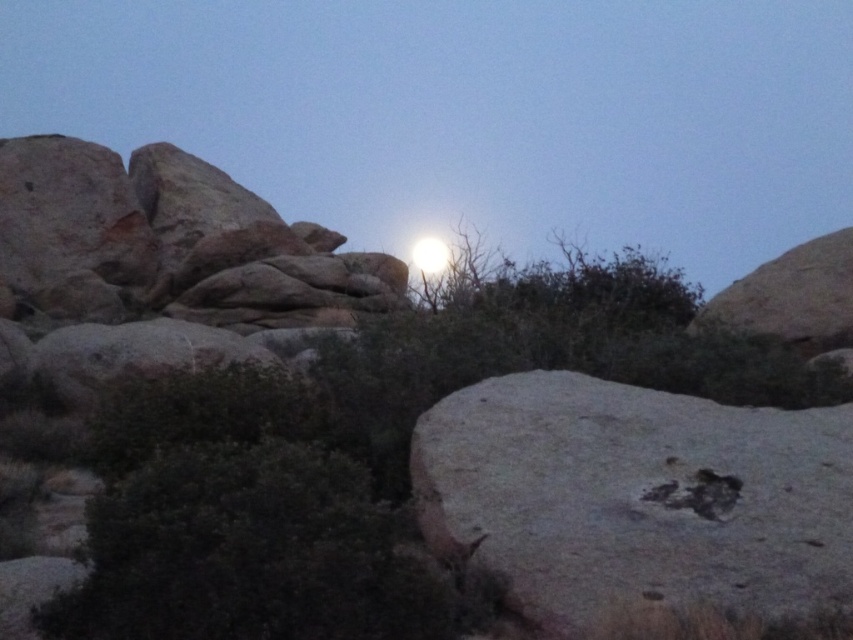
You are a geologist examining the rocks in the twilight scene. You have a measuring tape and need to determine which rock is bigger between the smooth rock at center and the gray rough rock at center. Which one should you measure first based on the scene?

The smooth rock at center is larger in size than the gray rough rock at center, so you should measure the smooth rock at center first.

You are standing at the point with coordinates point (714, 445) and want to walk towards the point with coordinates point (392, 88). Which direction should you face to walk towards the destination?

You should face towards the direction opposite of point (714, 445) to walk towards point (392, 88) since it is behind point (714, 445).